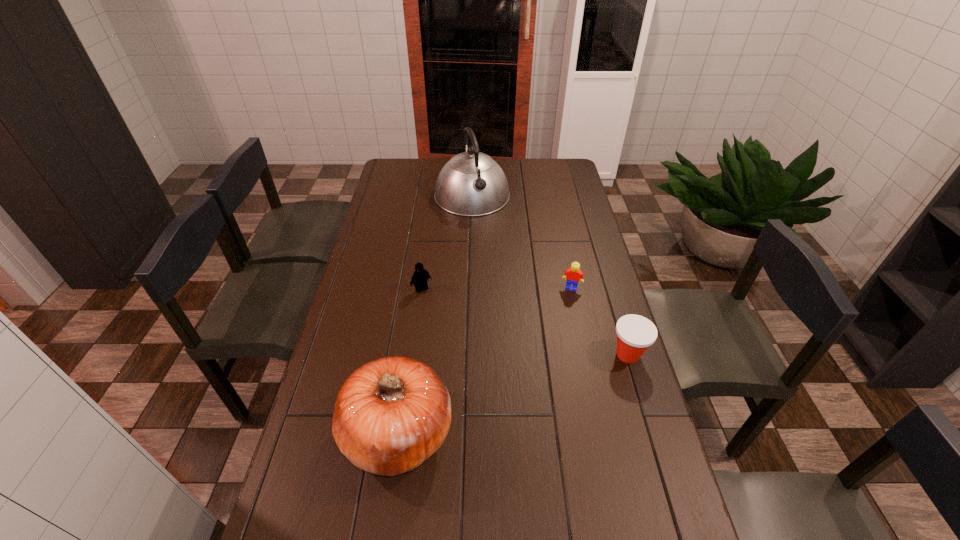
Where is `object located in the left edge section of the desktop`? This screenshot has width=960, height=540. object located in the left edge section of the desktop is located at coordinates (391, 414).

In order to click on Dixie cup located at the right edge in this screenshot , I will do `click(635, 333)`.

At what (x,y) coordinates should I click in order to perform the action: click on Lego that is at the right edge. Please return your answer as a coordinate pair (x, y). The width and height of the screenshot is (960, 540). Looking at the image, I should click on (573, 274).

Locate an element on the screen. vacant space at the near edge of the desktop is located at coordinates (547, 536).

In the image, there is a desktop. Identify the location of blank space at the left edge. pos(383,289).

This screenshot has width=960, height=540. What are the coordinates of `blank space at the right edge of the desktop` in the screenshot? It's located at (605, 365).

The height and width of the screenshot is (540, 960). In the image, there is a desktop. Find the location of `vacant area at the far left corner`. vacant area at the far left corner is located at coordinates [415, 177].

At what (x,y) coordinates should I click in order to perform the action: click on free space at the far right corner of the desktop. Please return your answer as a coordinate pair (x, y). This screenshot has width=960, height=540. Looking at the image, I should click on (548, 171).

At what (x,y) coordinates should I click in order to perform the action: click on vacant space in between the nearest object and the fourth object from left to right. Please return your answer as a coordinate pair (x, y). Looking at the image, I should click on (485, 360).

Where is `empty space that is in between the second object from right to left and the second nearest object`? empty space that is in between the second object from right to left and the second nearest object is located at coordinates (600, 321).